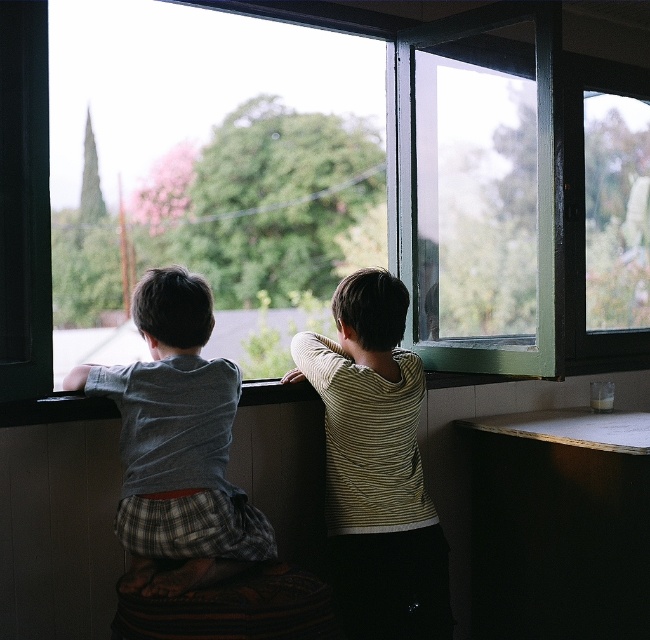
You are a parent trying to ensure your children are safe while sitting near the window. The green glass window at center and the gray cotton shirt at left are in the scene. Which object is higher up in the image?

The green glass window at center is positioned over the gray cotton shirt at left, meaning it is higher up in the image.

Looking at this image, you are a parent trying to dress your children properly. You have two shirts available, the striped cotton shirt at center and the gray cotton shirt at left. Which shirt should you choose for the child who is sitting closer to the window frame?

The striped cotton shirt at center is located below the gray cotton shirt at left, so the child wearing the striped cotton shirt at center is sitting lower and closer to the window frame. Therefore, you should choose the striped cotton shirt at center for the child who is sitting closer to the window frame.